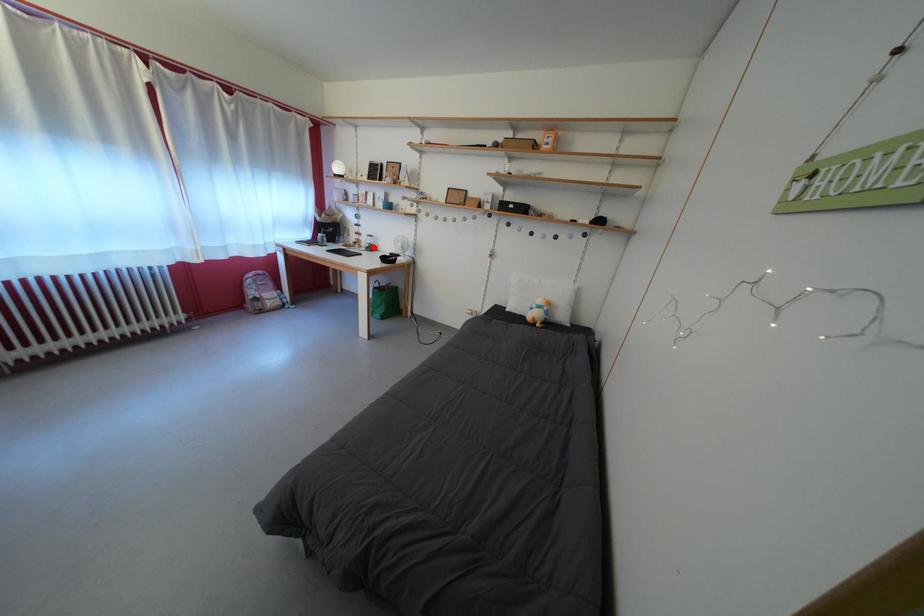
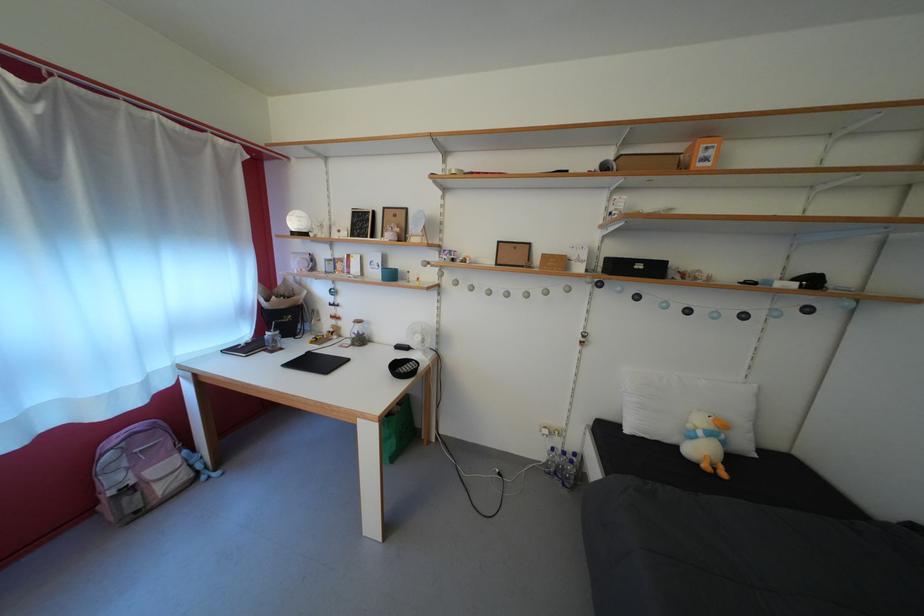
Where in the second image is the point corresponding to the highlighted location from the first image?

(358, 334)